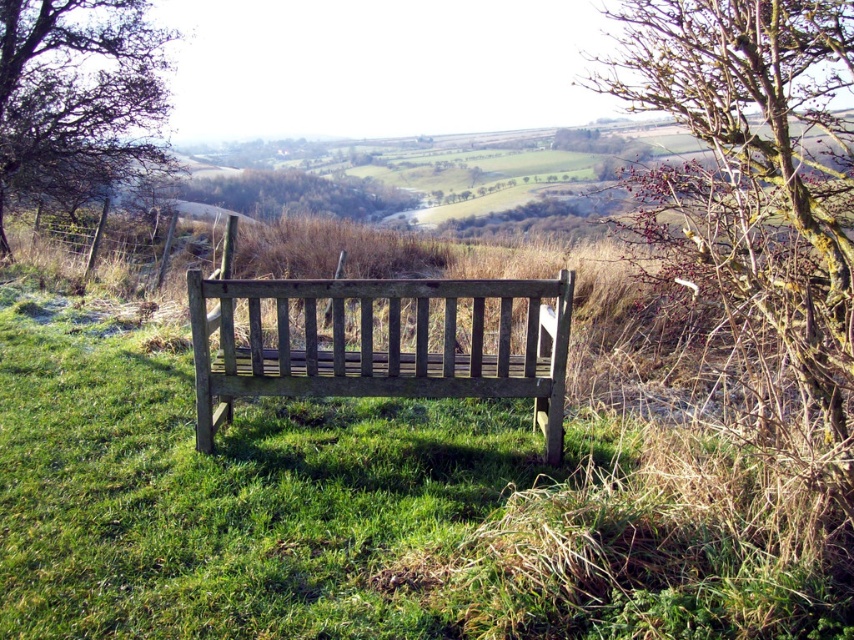
Question: Is wooden bench at center bigger than brown textured tree at upper left?

Choices:
 (A) yes
 (B) no

Answer: (B)

Question: Considering the real-world distances, which object is farthest from the wooden bench at center?

Choices:
 (A) green leafy tree at center
 (B) brown textured tree at upper left

Answer: (A)

Question: Which of the following is the closest to the observer?

Choices:
 (A) wooden bench at center
 (B) brown textured tree at upper left
 (C) green leafy tree at center

Answer: (A)

Question: Does brown textured tree at upper left have a smaller size compared to green leafy tree at center?

Choices:
 (A) yes
 (B) no

Answer: (B)

Question: Does wooden bench at center appear over green leafy tree at center?

Choices:
 (A) no
 (B) yes

Answer: (A)

Question: Which of the following is the farthest from the observer?

Choices:
 (A) (401, 195)
 (B) (25, 40)
 (C) (252, 381)

Answer: (A)